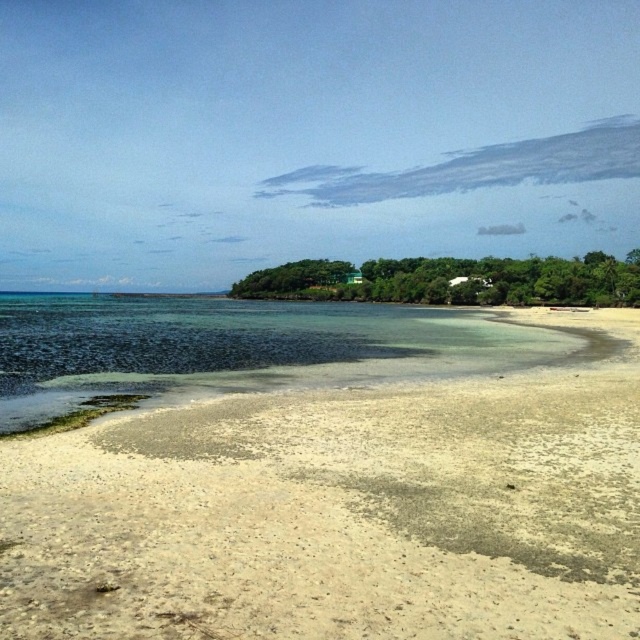
You are standing on the white sand beach at lower center and want to see the top of the green matte house at center. Can you see it clearly from your current position?

The white sand beach at lower center is not as tall as green matte house at center, so yes, you can see the top of the green matte house at center clearly from your current position on the white sand beach at lower center.

You are standing on the white sand beach at lower center and want to walk to the clear water at lower left. Which direction should you head towards?

Since the white sand beach at lower center occupies less space than the clear water at lower left, you should head towards the lower left direction to reach the clear water at lower left from the white sand beach at lower center.